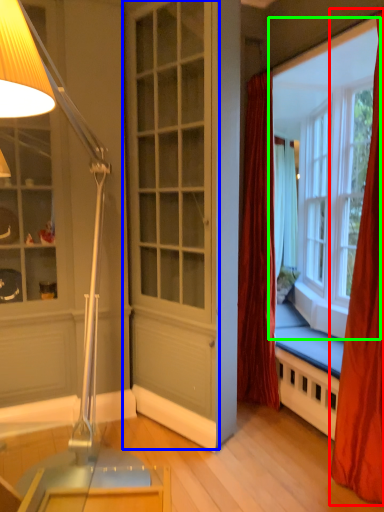
Question: Considering the real-world distances, which object is closest to curtain (highlighted by a red box)? screen door (highlighted by a blue box) or window (highlighted by a green box).

Choices:
 (A) screen door
 (B) window

Answer: (A)